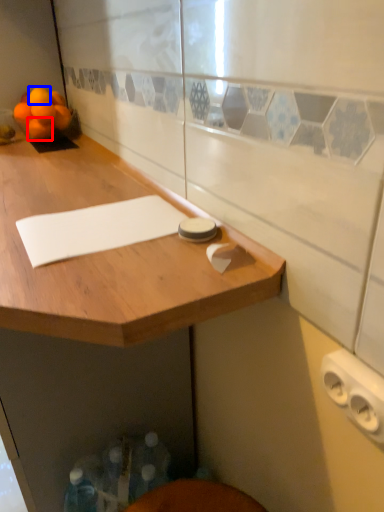
Question: Which point is further to the camera, orange (highlighted by a red box) or orange (highlighted by a blue box)?

Choices:
 (A) orange
 (B) orange

Answer: (A)